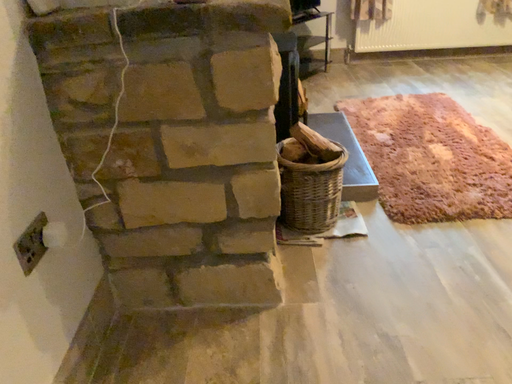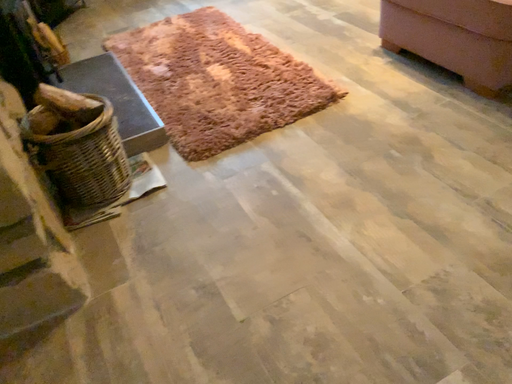
Question: Which way did the camera rotate in the video?

Choices:
 (A) rotated right
 (B) rotated left

Answer: (A)